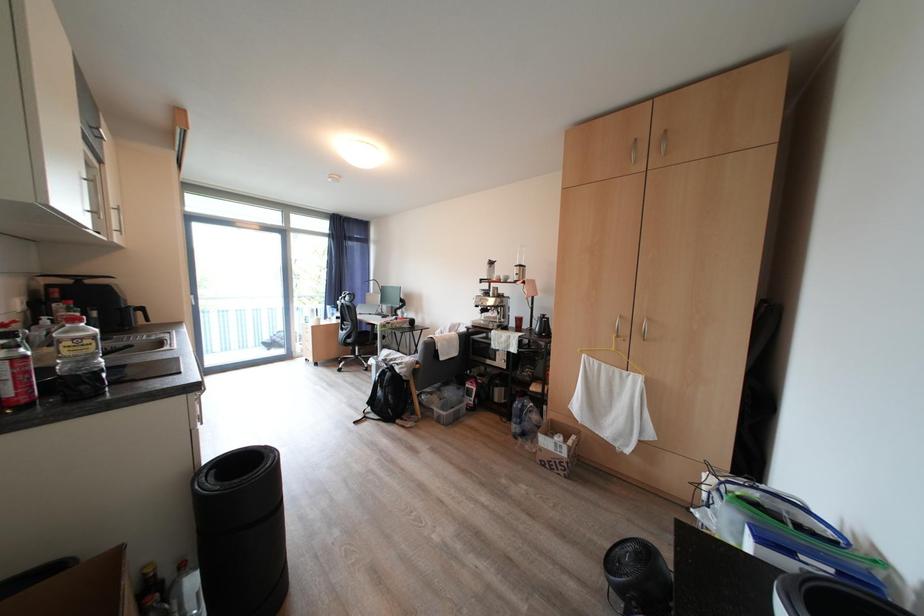
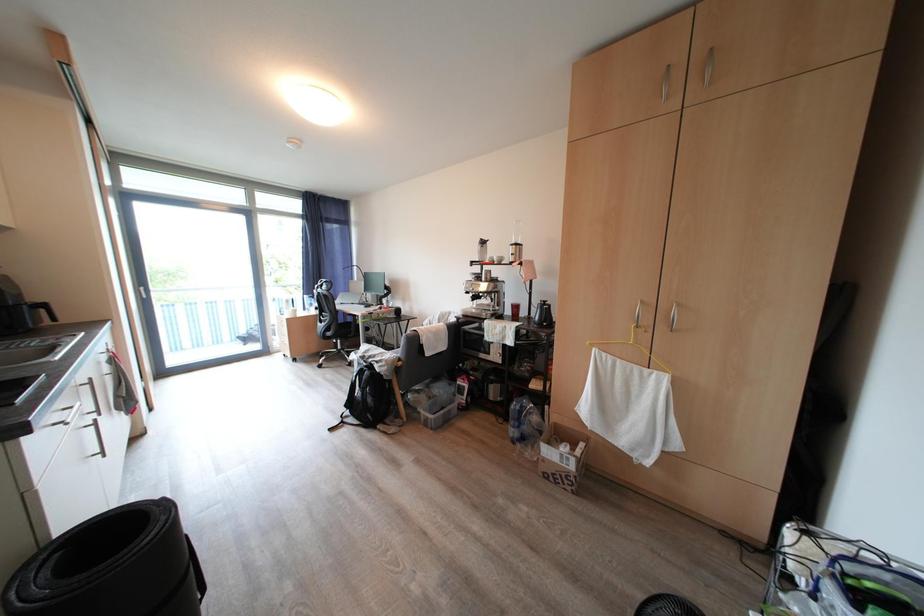
Question: What movement of the cameraman would produce the second image?

Choices:
 (A) Left
 (B) Right
 (C) Forward
 (D) Backward

Answer: (C)